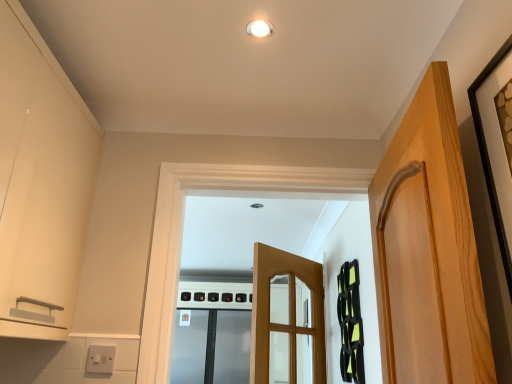
Where is `vacant area on the back side of white glossy light fixture at upper center`? The image size is (512, 384). vacant area on the back side of white glossy light fixture at upper center is located at coordinates (263, 61).